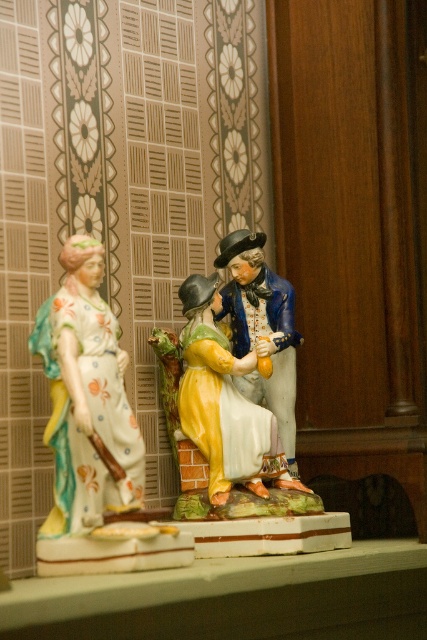
You are arranging a display of porcelain figurines on a shelf. You have two figurines to place. The porcelain figurine at left and the porcelain figure at center. According to the scene, which figurine should be placed lower on the shelf?

The porcelain figurine at left should be placed lower on the shelf because it is described as being below the porcelain figure at center in the scene.

You are an interior designer arranging a shelf display. You have two porcelain items to place on a shelf that can only accommodate items up to 12 inches in height. The porcelain figurine at left and the porcelain figure at center are both available. Based on their sizes, which one should you choose to ensure it fits within the height restriction?

The porcelain figurine at left is taller than the porcelain figure at center. Since the shelf has a 12 inches height limit, you should choose the porcelain figure at center to ensure it fits.

You are standing in front of a shelf displaying decorative ceramic figurines. There is a porcelain figurine at left. If you want to reach it without moving your body, what is the minimum distance you need to stretch your hand forward?

The porcelain figurine at left is 4.04 feet away from the camera, so you need to stretch your hand forward at least 4.04 feet to reach it without moving your body.